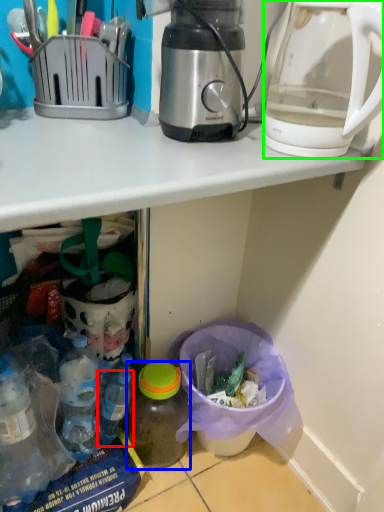
Question: Which object is the farthest from bottle (highlighted by a red box)? Choose among these: bottle (highlighted by a blue box) or kettle (highlighted by a green box).

Choices:
 (A) bottle
 (B) kettle

Answer: (B)